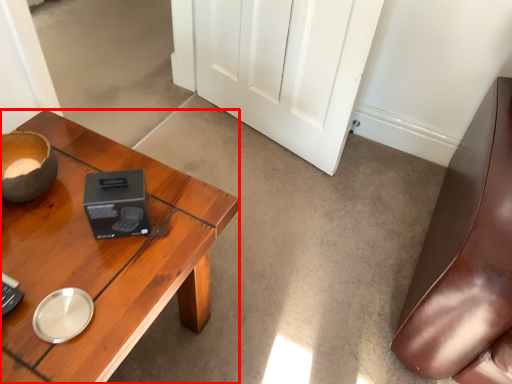
Question: From the image's perspective, what is the correct spatial relationship of desk (annotated by the red box) in relation to door?

Choices:
 (A) above
 (B) below

Answer: (B)